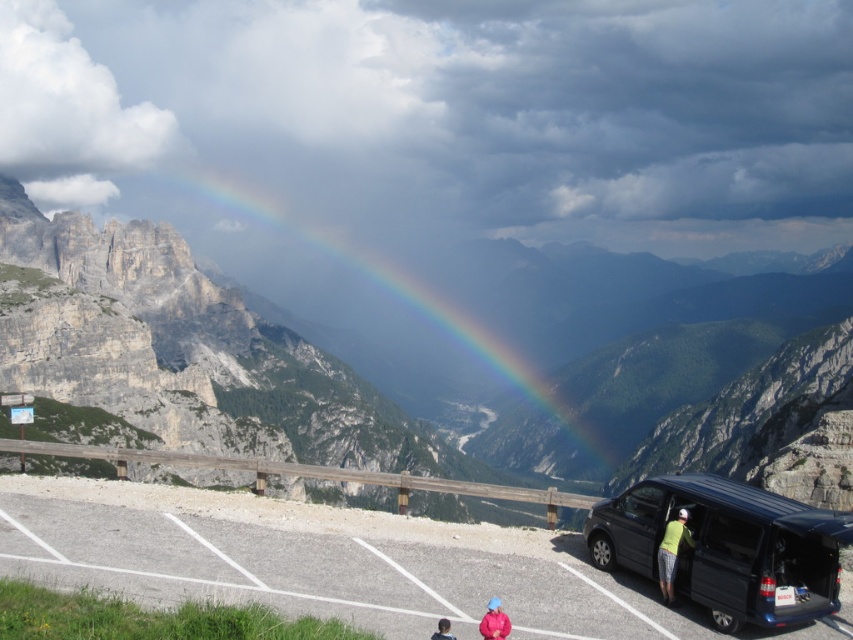
Which is above, dark gray asphalt parking lot at lower center or pink fabric jacket at lower center?

dark gray asphalt parking lot at lower center is above.

Is dark gray asphalt parking lot at lower center wider than pink fabric jacket at lower center?

Yes.

Is point (412, 563) positioned behind point (502, 625)?

Yes, point (412, 563) is behind point (502, 625).

Identify the location of dark gray asphalt parking lot at lower center. (321, 561).

Which is below, pink fabric jacket at lower center or smooth blue shirt at lower center?

smooth blue shirt at lower center is lower down.

Measure the distance between pink fabric jacket at lower center and camera.

A distance of 118.63 feet exists between pink fabric jacket at lower center and camera.

Locate an element on the screen. pink fabric jacket at lower center is located at coordinates point(494,621).

The width and height of the screenshot is (853, 640). I want to click on rainbow at upper center, so click(376, 392).